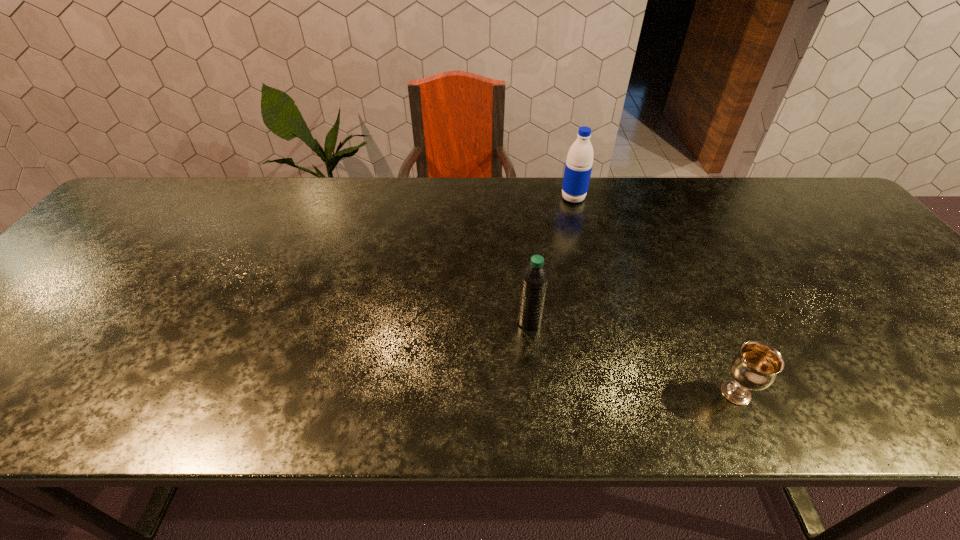
Identify the location of the farther water bottle. The height and width of the screenshot is (540, 960). (578, 167).

Find the location of a particular element. This screenshot has width=960, height=540. the second object from left to right is located at coordinates (578, 167).

This screenshot has width=960, height=540. In order to click on the leftmost object in this screenshot , I will do `click(535, 276)`.

At what (x,y) coordinates should I click in order to perform the action: click on the second farthest object. Please return your answer as a coordinate pair (x, y). The height and width of the screenshot is (540, 960). Looking at the image, I should click on (535, 276).

Identify the location of the nearest object. This screenshot has height=540, width=960. (755, 367).

Where is `the rightmost object`? The image size is (960, 540). the rightmost object is located at coordinates (755, 367).

I want to click on vacant space located on the front of the right water bottle, so click(x=582, y=234).

The height and width of the screenshot is (540, 960). What are the coordinates of `vacant space positioned on the back of the leftmost object` in the screenshot? It's located at (520, 226).

Where is `free location located on the back of the chalice`? This screenshot has width=960, height=540. free location located on the back of the chalice is located at coordinates (712, 341).

At what (x,y) coordinates should I click in order to perform the action: click on object present at the far edge. Please return your answer as a coordinate pair (x, y). Looking at the image, I should click on (578, 167).